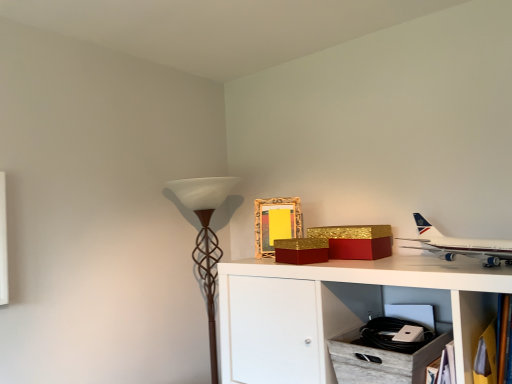
The width and height of the screenshot is (512, 384). I want to click on empty space that is ontop of wooden crate at lower center, so click(396, 335).